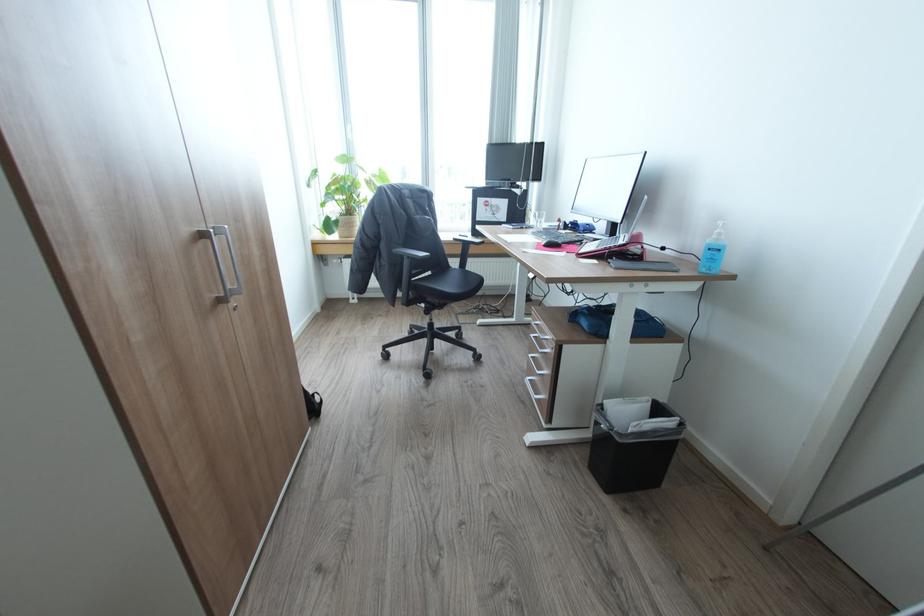
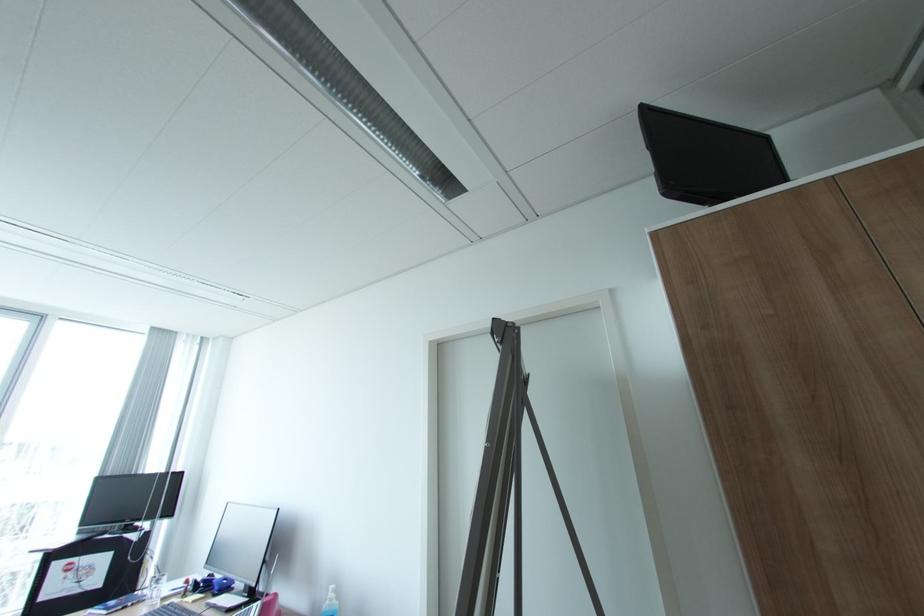
Where in the second image is the point corresponding to (543,225) from the first image?

(160, 596)